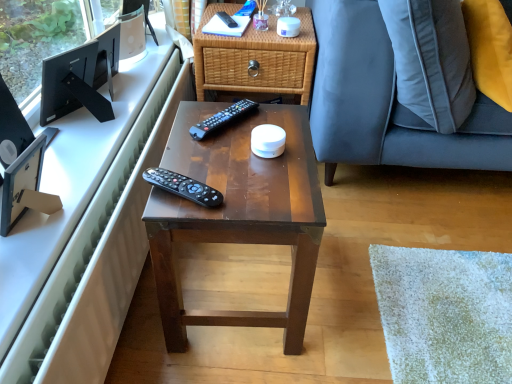
Find the location of a particular element. The height and width of the screenshot is (384, 512). free location above brown polished wood desk at center (from a real-world perspective) is located at coordinates (237, 148).